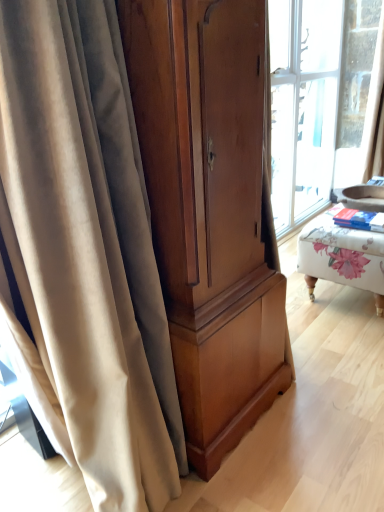
Find the location of a particular element. This screenshot has width=384, height=512. free point to the right of matte wood cabinet at center is located at coordinates (330, 414).